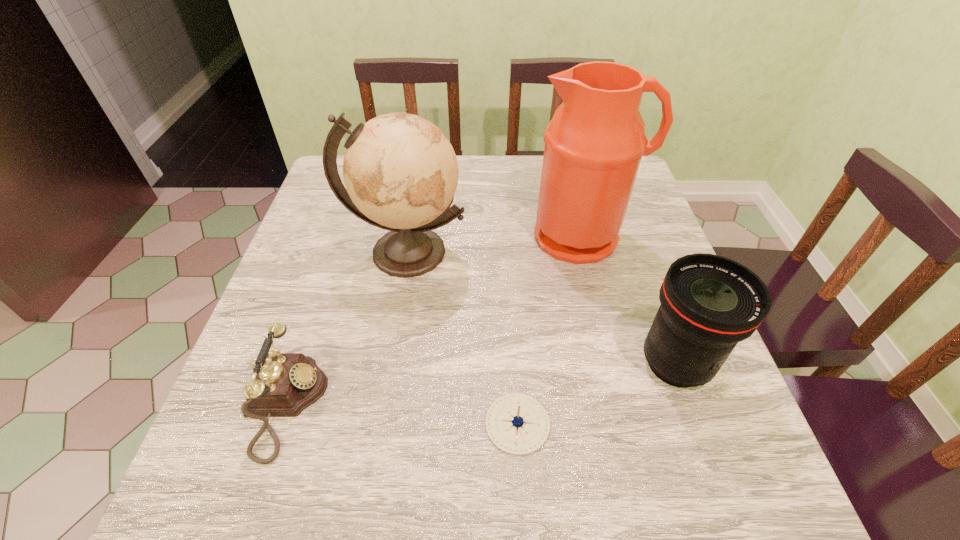
Where is `free region at the near left corner`? This screenshot has width=960, height=540. free region at the near left corner is located at coordinates (254, 508).

Identify the location of vacant space that is in between the globe and the shortest object. The image size is (960, 540). (462, 338).

The width and height of the screenshot is (960, 540). What are the coordinates of `empty location between the shortest object and the third shortest object` in the screenshot? It's located at (596, 394).

You are a GUI agent. You are given a task and a screenshot of the screen. Output one action in this format:
    pyautogui.click(x=<x>, y=<y>)
    Task: Click on the unoccupied position between the water jug and the globe
    Image resolution: width=960 pixels, height=540 pixels.
    Given the screenshot: What is the action you would take?
    pyautogui.click(x=494, y=244)

The height and width of the screenshot is (540, 960). What are the coordinates of `unoccupied area between the telephoto lens and the third object from left to right` in the screenshot? It's located at (596, 394).

You are a GUI agent. You are given a task and a screenshot of the screen. Output one action in this format:
    pyautogui.click(x=<x>, y=<y>)
    Task: Click on the vacant area that lies between the globe and the third object from left to right
    The height and width of the screenshot is (540, 960).
    Given the screenshot: What is the action you would take?
    pyautogui.click(x=462, y=338)

The height and width of the screenshot is (540, 960). I want to click on vacant area that lies between the fourth tallest object and the third object from right to left, so click(401, 414).

Identify the location of vacant area that lies between the second shortest object and the third object from right to left. The image size is (960, 540). (401, 414).

Find the location of a particular element. This screenshot has width=960, height=540. blank region between the third object from right to left and the water jug is located at coordinates (550, 330).

This screenshot has height=540, width=960. Find the location of `free space between the shortest object and the telephone`. free space between the shortest object and the telephone is located at coordinates (401, 414).